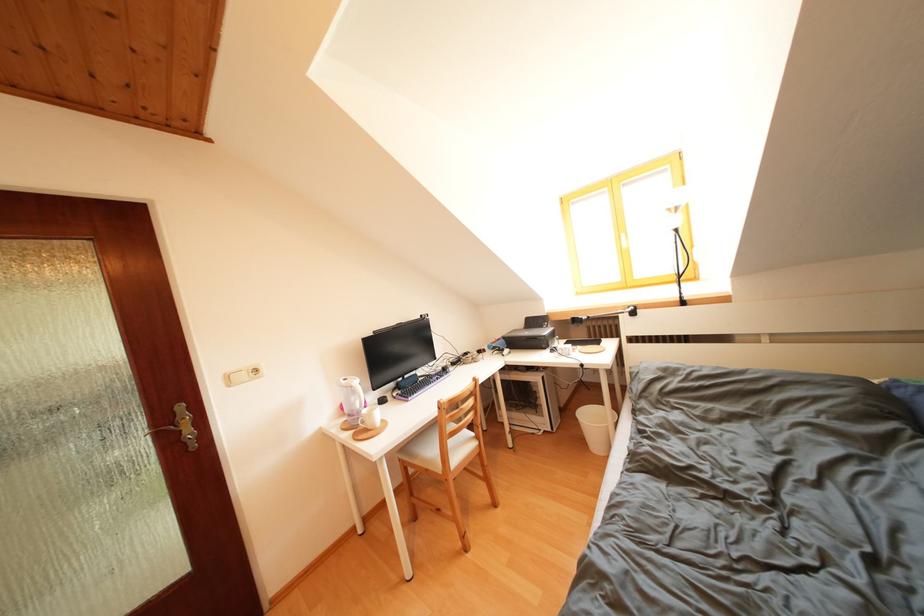
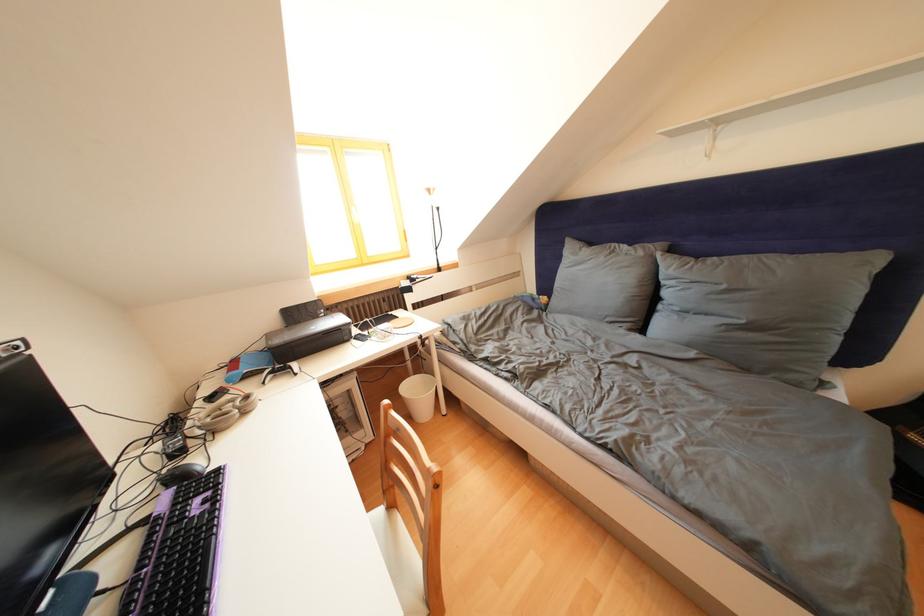
In the second image, find the point that corresponds to (x=487, y=357) in the first image.

(220, 403)